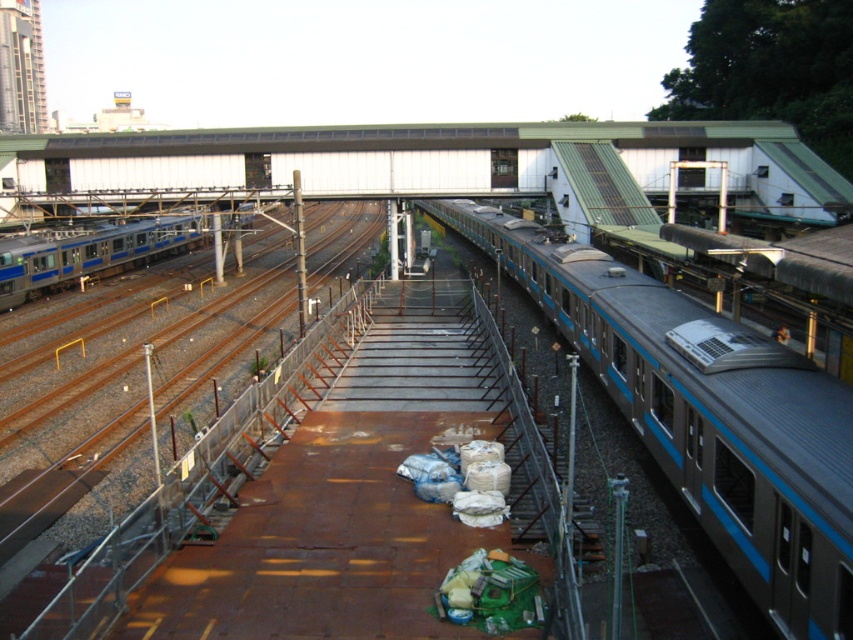
Is blue metallic train at center closer to the viewer compared to brown metal train track at center?

Yes, it is in front of brown metal train track at center.

The height and width of the screenshot is (640, 853). Identify the location of blue metallic train at center. (706, 416).

Find the location of a particular element. The height and width of the screenshot is (640, 853). blue metallic train at center is located at coordinates (706, 416).

Can you confirm if blue metallic train at center is wider than silver metallic train at left?

In fact, blue metallic train at center might be narrower than silver metallic train at left.

I want to click on blue metallic train at center, so tap(706, 416).

The height and width of the screenshot is (640, 853). What are the coordinates of `blue metallic train at center` in the screenshot? It's located at (706, 416).

Is point (4, 516) positioned before point (21, 273)?

Yes, point (4, 516) is closer to viewer.

Between brown metal train track at center and silver metallic train at left, which one is positioned higher?

brown metal train track at center is higher up.

Does point (225, 381) come farther from viewer compared to point (138, 244)?

No.

This screenshot has width=853, height=640. I want to click on brown metal train track at center, so click(138, 406).